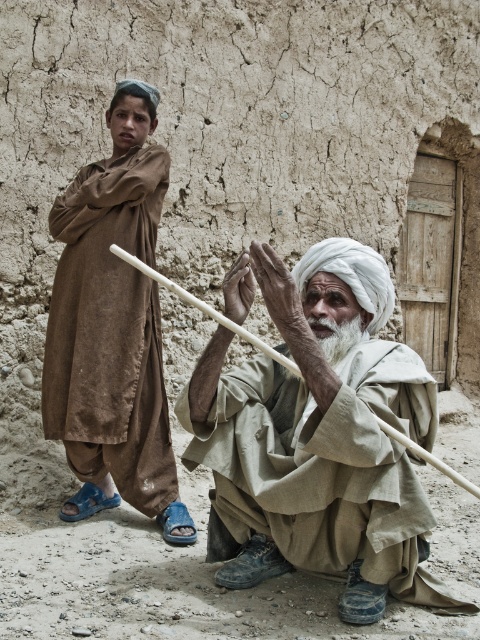
You are standing at the origin point in the image. There are two points marked in the scene. Which of the two points, point (78, 467) or point (342, 321), is farther away from you?

Point (78, 467) is behind point (342, 321), so it is farther away from you.

You are a tailor in this rural setting and need to decide which item, the light beige fabric at center or the white soft beard at center, can be used to cover a larger surface area. Based on their sizes, which one would you choose?

The light beige fabric at center has a larger width than the white soft beard at center, so it can cover a larger surface area.